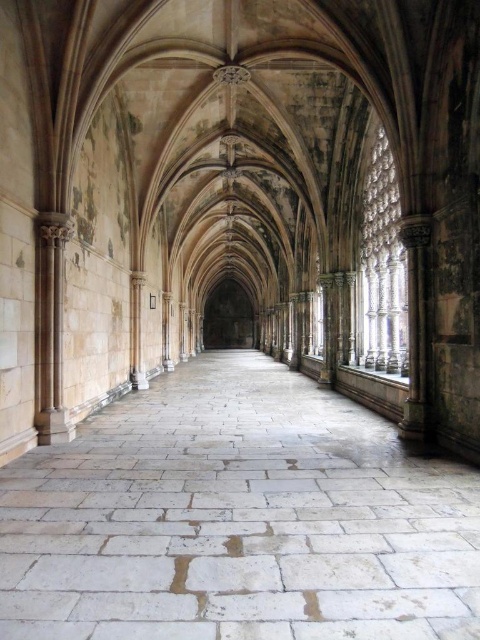
Question: Which object appears closest to the camera in this image?

Choices:
 (A) light beige stone column at left
 (B) white stone floor at center

Answer: (B)

Question: Among these points, which one is farthest from the camera?

Choices:
 (A) (261, 392)
 (B) (36, 362)

Answer: (A)

Question: Which of the following is the farthest from the observer?

Choices:
 (A) coord(40,376)
 (B) coord(364,456)

Answer: (A)

Question: Considering the relative positions of white stone floor at center and light beige stone column at left in the image provided, where is white stone floor at center located with respect to light beige stone column at left?

Choices:
 (A) left
 (B) right

Answer: (B)

Question: Does white stone floor at center appear on the left side of light beige stone column at left?

Choices:
 (A) no
 (B) yes

Answer: (A)

Question: Does white stone floor at center have a smaller size compared to light beige stone column at left?

Choices:
 (A) no
 (B) yes

Answer: (A)